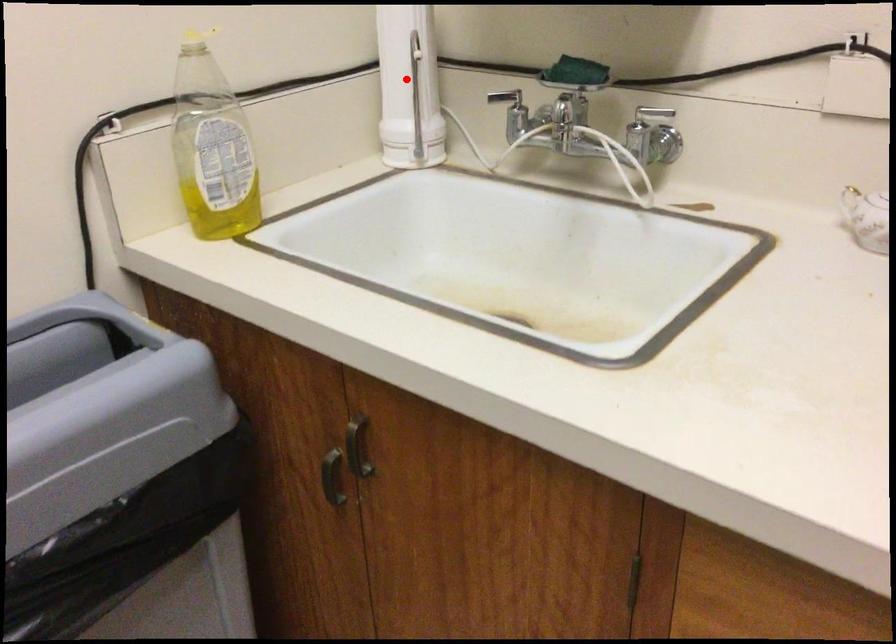
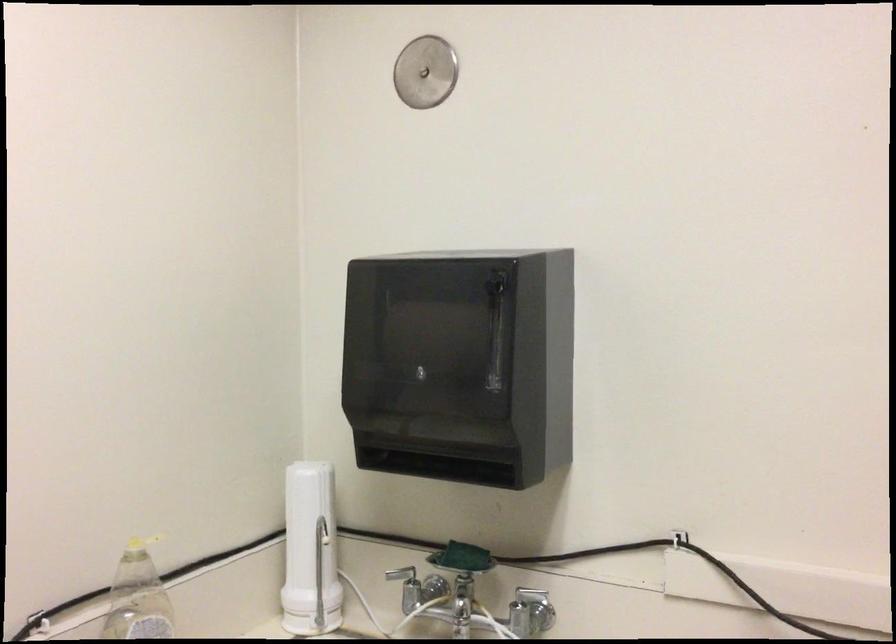
Question: I am providing you with two images of the same scene from different viewpoints. A red point is shown in image1. For the corresponding object point in image2, is it positioned nearer or farther from the camera?

Choices:
 (A) Nearer
 (B) Farther

Answer: (B)